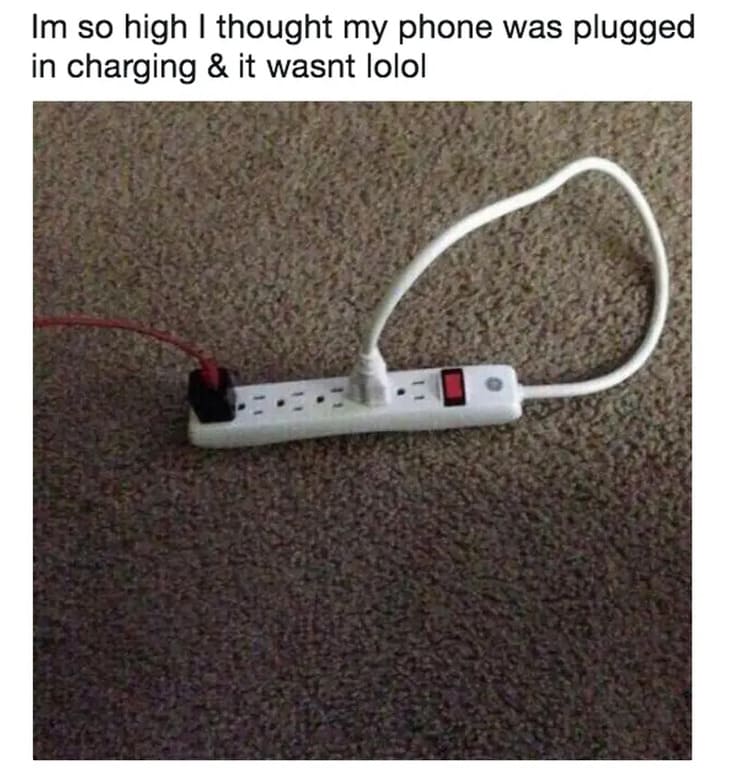
Identify the location of carpet. (430, 603).